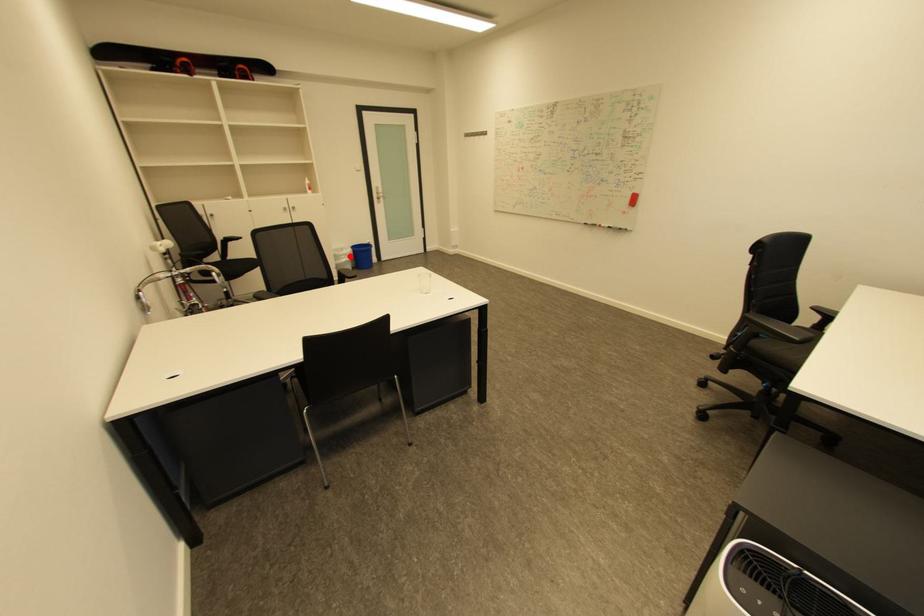
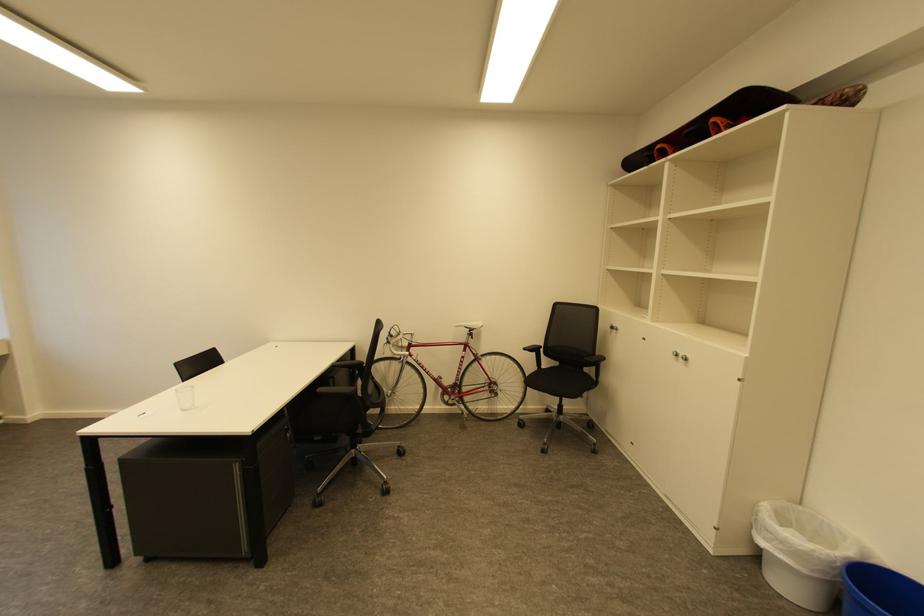
Find the pixel in the second image that matches the highlighted location in the first image.

(775, 533)